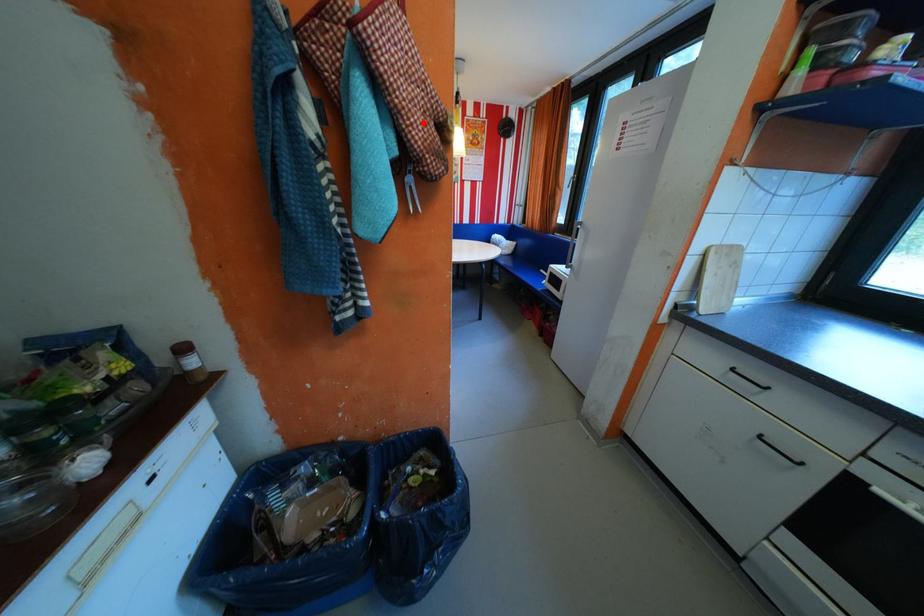
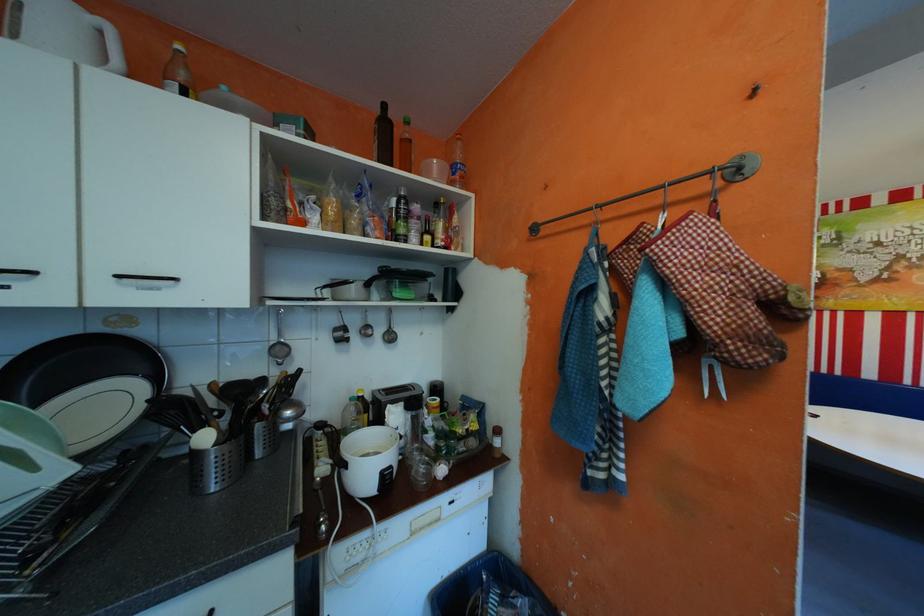
Where in the second image is the point corresponding to the highlighted location from the first image?

(715, 310)